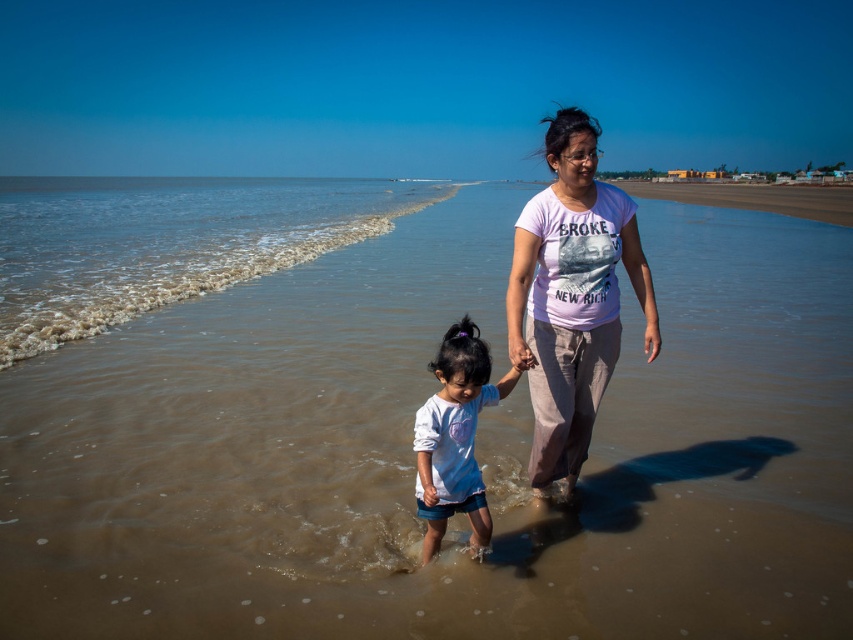
Is brown sand at lower center closer to the viewer compared to white cotton shirt at center?

No, brown sand at lower center is behind white cotton shirt at center.

Which is behind, point (302, 604) or point (474, 516)?

Positioned behind is point (474, 516).

This screenshot has width=853, height=640. Describe the element at coordinates (405, 420) in the screenshot. I see `brown sand at lower center` at that location.

Find the location of a particular element. The image size is (853, 640). brown sand at lower center is located at coordinates (405, 420).

Who is taller, brown sand at lower left or white cotton shirt at center?

brown sand at lower left is taller.

Find the location of a particular element. Image resolution: width=853 pixels, height=640 pixels. brown sand at lower left is located at coordinates (165, 243).

Identify the location of brown sand at lower left. (165, 243).

Does brown sand at lower center have a lesser width compared to brown sand at lower left?

Yes.

Who is more distant from viewer, (131, 593) or (289, 260)?

Positioned behind is point (289, 260).

Does point (305, 477) come in front of point (213, 177)?

Yes, it is.

You are a GUI agent. You are given a task and a screenshot of the screen. Output one action in this format:
    pyautogui.click(x=<x>, y=<y>)
    Task: Click on the brown sand at lower center
    
    Given the screenshot: What is the action you would take?
    pyautogui.click(x=405, y=420)